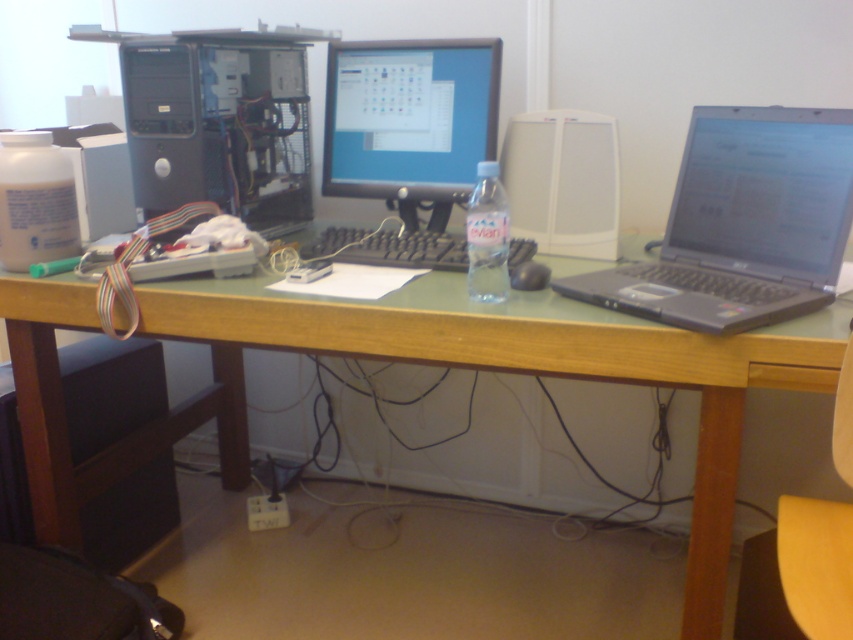
Question: Is matte plastic monitor at center smaller than black plastic mouse at center?

Choices:
 (A) yes
 (B) no

Answer: (B)

Question: Does white plastic bottle at left lie behind black plastic mouse at center?

Choices:
 (A) no
 (B) yes

Answer: (B)

Question: Which object is the closest to the matte plastic monitor at center?

Choices:
 (A) black matte keyboard at center
 (B) black plastic laptop at right
 (C) black plastic mouse at center

Answer: (A)

Question: Is white plastic bottle at left closer to camera compared to black plastic mouse at center?

Choices:
 (A) yes
 (B) no

Answer: (B)

Question: Which of the following is the closest to the observer?

Choices:
 (A) black matte keyboard at center
 (B) black plastic mouse at center

Answer: (B)

Question: Which object is the farthest from the matte plastic monitor at center?

Choices:
 (A) black plastic mouse at center
 (B) black matte keyboard at center
 (C) green wood computer desk at center

Answer: (A)